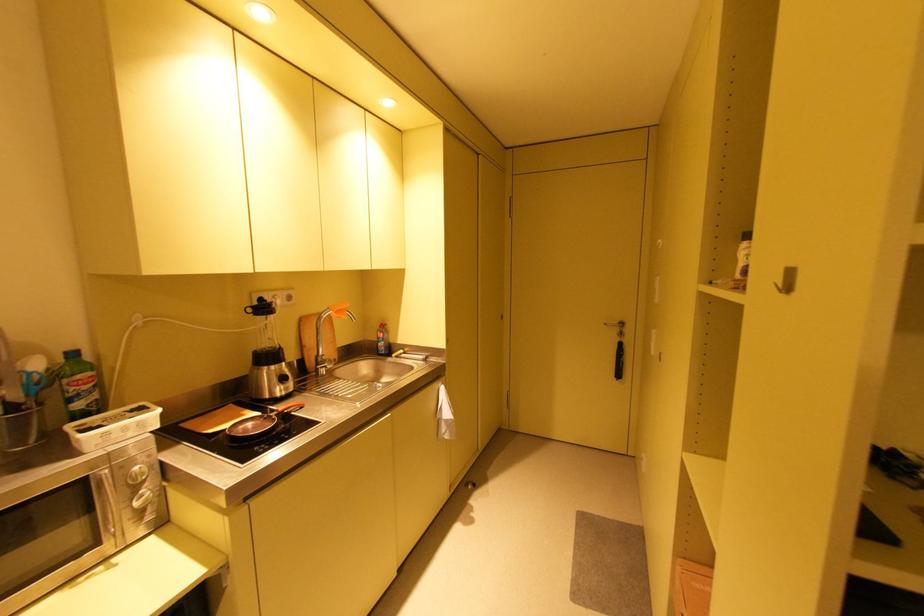
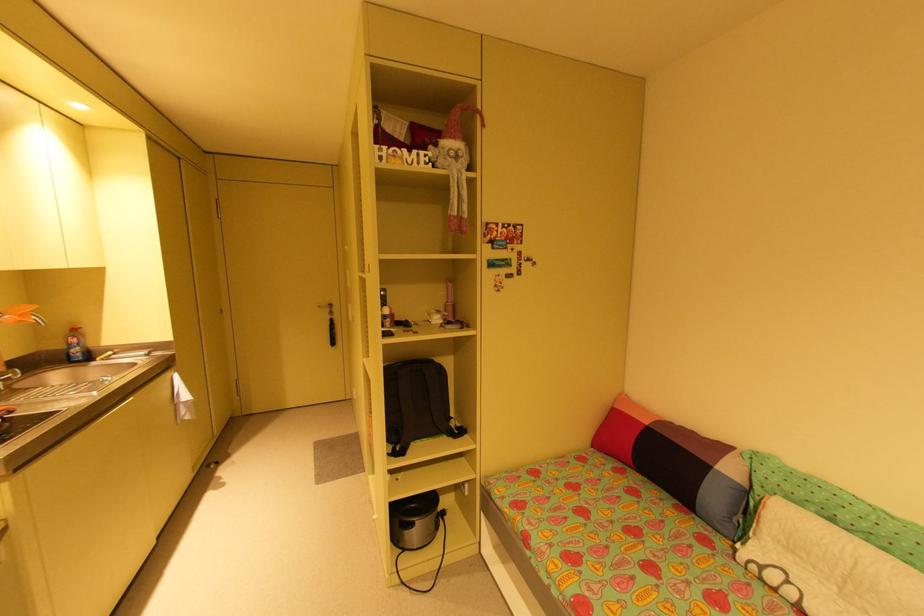
Where in the second image is the point corresponding to [387,326] from the first image?

(79, 331)